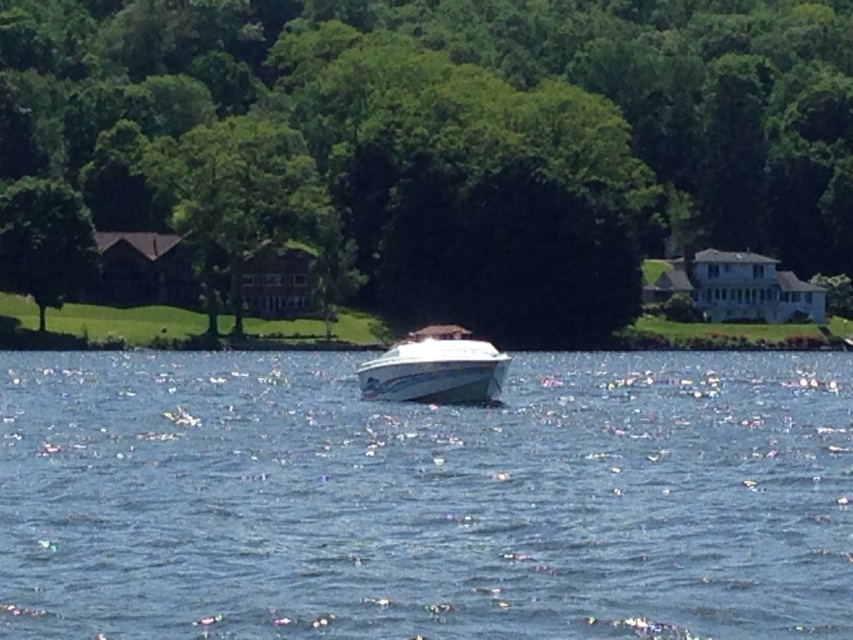
You are a photographer planning to capture the blue water at center and the green leafy tree at center in a single shot. Based on their relative sizes in the image, which object would appear larger in the photo?

The green leafy tree at center appears larger in the photo because it is taller than the blue water at center, which is shorter.

You are a photographer planning to take a landscape photo of the blue water at center and the green leafy tree at left. Which object should you focus on first if you want to capture both in sharp detail?

The blue water at center should be focused on first because it is shorter than the green leafy tree at left, so focusing on the closer object ensures both will be in focus due to the depth of field.